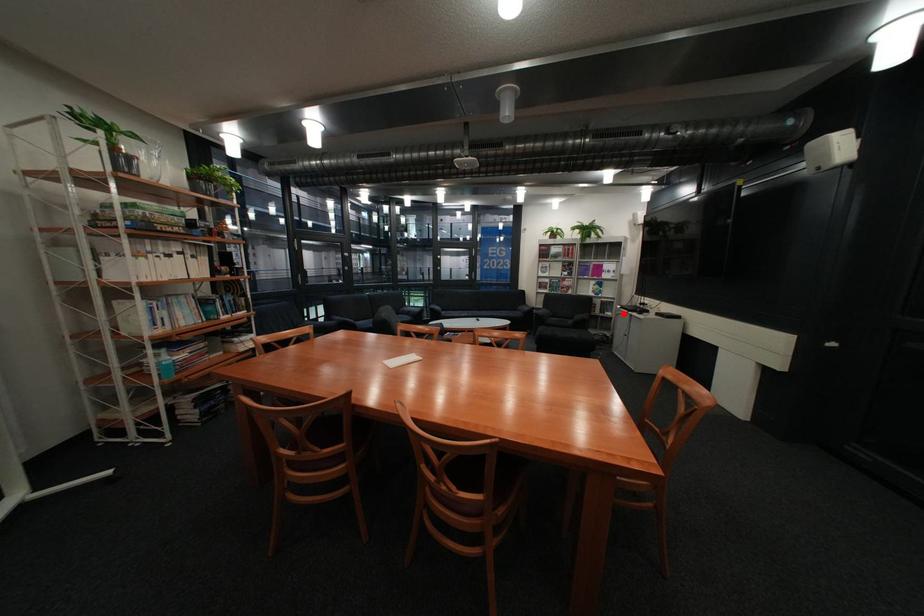
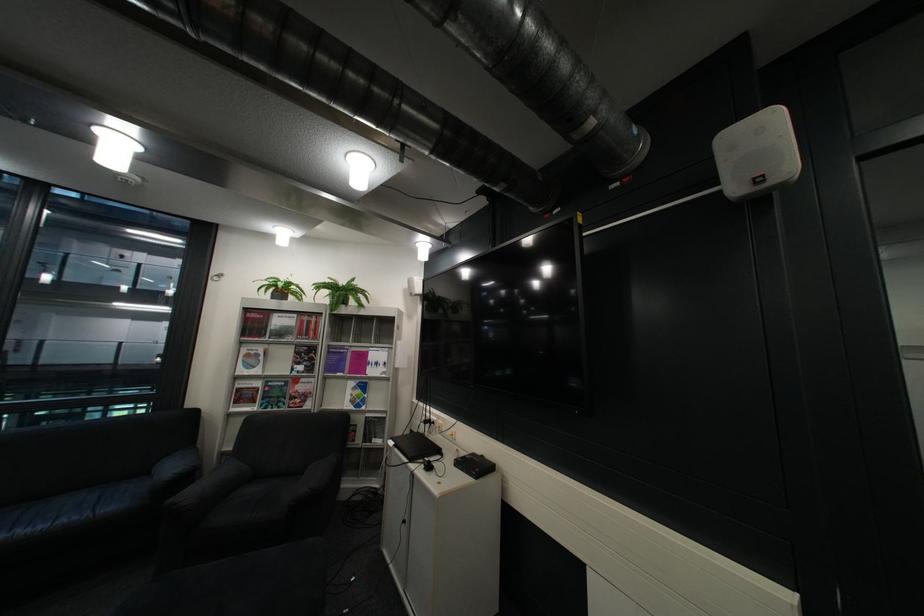
Where in the second image is the point corresponding to the highlighted location from the first image?

(393, 442)